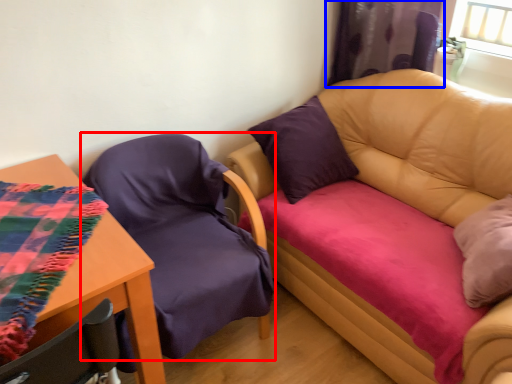
Question: Which object is further to the camera taking this photo, chair (highlighted by a red box) or curtain (highlighted by a blue box)?

Choices:
 (A) chair
 (B) curtain

Answer: (B)